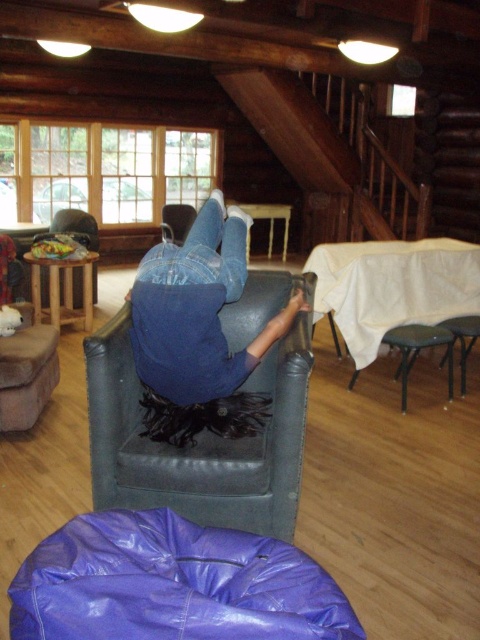
Does purple vinyl bean bag at lower center have a lesser height compared to blue leather chair at center?

Yes, purple vinyl bean bag at lower center is shorter than blue leather chair at center.

Can you confirm if purple vinyl bean bag at lower center is thinner than blue leather chair at center?

Incorrect, purple vinyl bean bag at lower center's width is not less than blue leather chair at center's.

Who is more forward, (129, 582) or (196, 292)?

Point (129, 582)

At what (x,y) coordinates should I click in order to perform the action: click on purple vinyl bean bag at lower center. Please return your answer as a coordinate pair (x, y). This screenshot has height=640, width=480. Looking at the image, I should click on (171, 584).